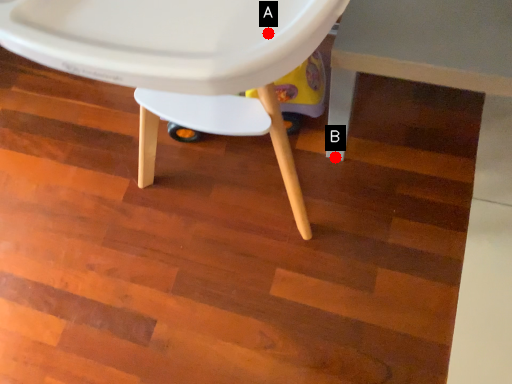
Question: Two points are circled on the image, labeled by A and B beside each circle. Which point appears closest to the camera in this image?

Choices:
 (A) A is closer
 (B) B is closer

Answer: (A)